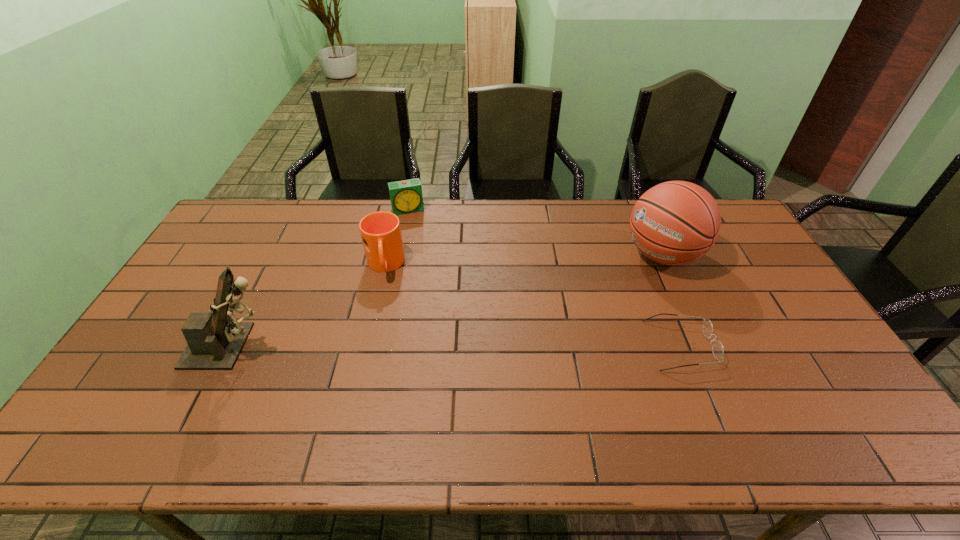
At what (x,y) coordinates should I click in order to perform the action: click on free spot between the second shortest object and the spectacles. Please return your answer as a coordinate pair (x, y). The height and width of the screenshot is (540, 960). Looking at the image, I should click on (544, 278).

At what (x,y) coordinates should I click in order to perform the action: click on empty location between the mug and the leftmost object. Please return your answer as a coordinate pair (x, y). Looking at the image, I should click on (309, 306).

Where is `free area in between the basketball and the figurine`? free area in between the basketball and the figurine is located at coordinates 448,300.

This screenshot has height=540, width=960. I want to click on blank region between the basketball and the mug, so click(x=523, y=260).

The width and height of the screenshot is (960, 540). Identify the location of unoccupied position between the third shortest object and the basketball. (523, 260).

The image size is (960, 540). Identify the location of free space between the figurine and the second shortest object. (321, 278).

Identify which object is the second closest to the second shortest object. Please provide its 2D coordinates. Your answer should be formatted as a tuple, i.e. [(x, y)], where the tuple contains the x and y coordinates of a point satisfying the conditions above.

[(215, 342)]

Locate which object is the fourth closest to the third shortest object. Please provide its 2D coordinates. Your answer should be formatted as a tuple, i.e. [(x, y)], where the tuple contains the x and y coordinates of a point satisfying the conditions above.

[(717, 347)]

Where is `free region that satisfies the following two spatial constraints: 1. on the front side of the mug; 2. through the lenses of the shortest object`? The width and height of the screenshot is (960, 540). free region that satisfies the following two spatial constraints: 1. on the front side of the mug; 2. through the lenses of the shortest object is located at coordinates (367, 345).